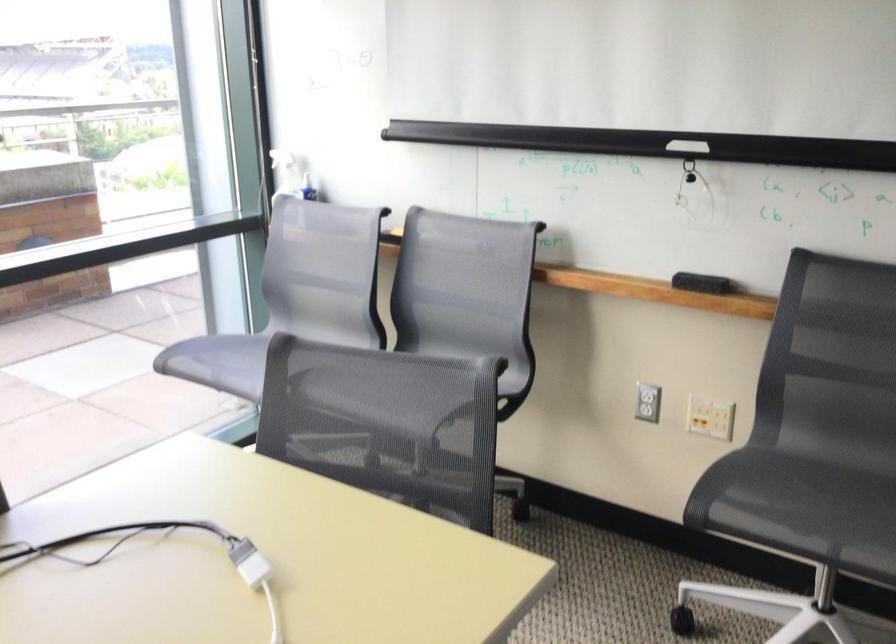
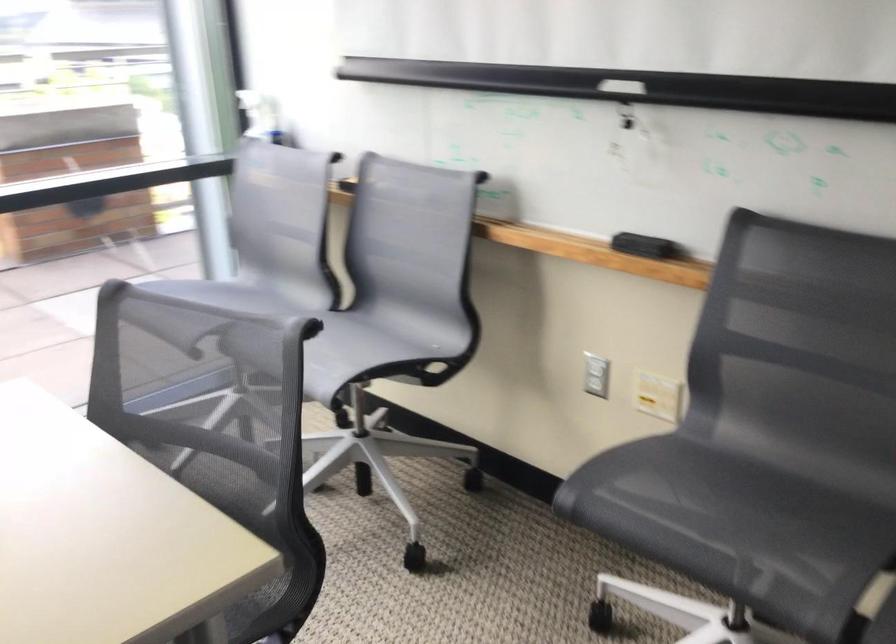
Question: The first image is from the beginning of the video and the second image is from the end. How did the camera likely rotate when shooting the video?

Choices:
 (A) Left
 (B) Right
 (C) Up
 (D) Down

Answer: (A)